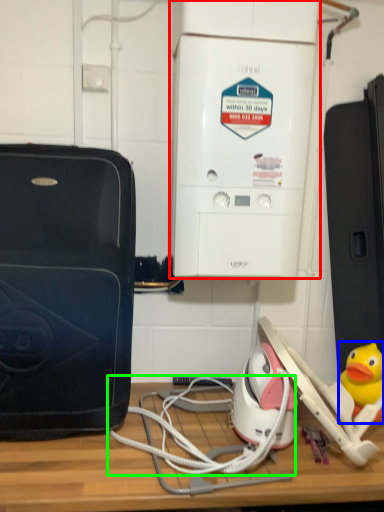
Question: Which object is the farthest from home appliance (highlighted by a red box)? Choose among these: toy (highlighted by a blue box) or cable (highlighted by a green box).

Choices:
 (A) toy
 (B) cable

Answer: (A)